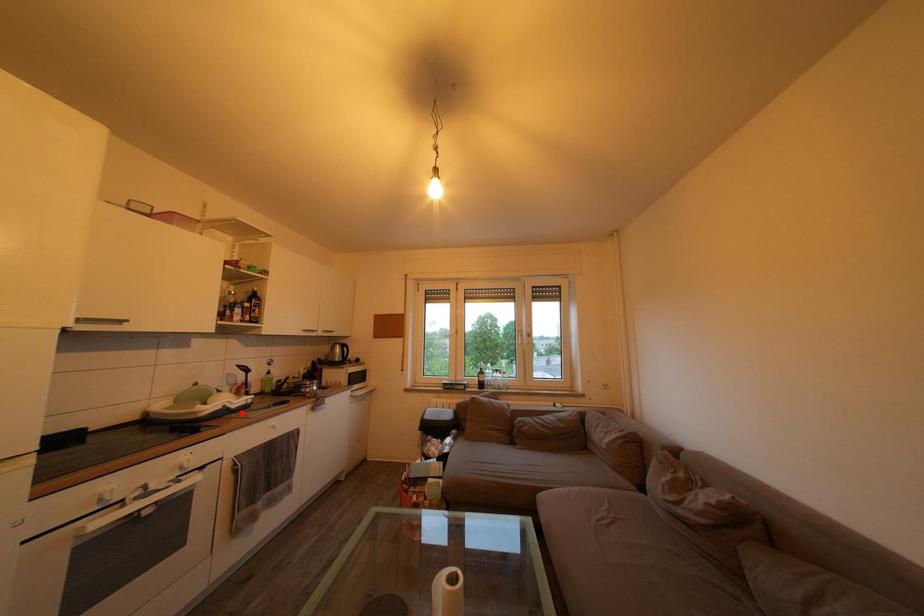
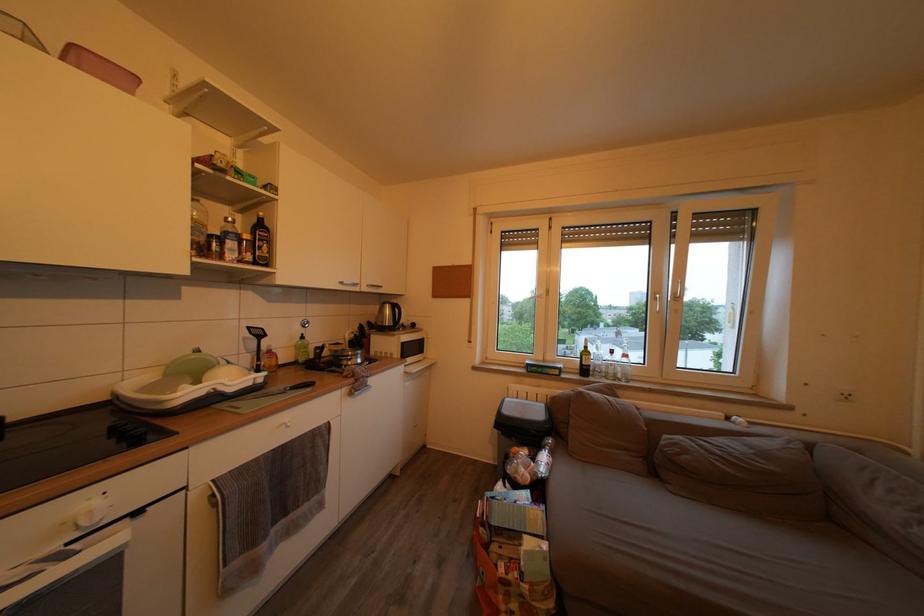
Locate, in the second image, the point that corresponds to the highlighted location in the first image.

(238, 397)